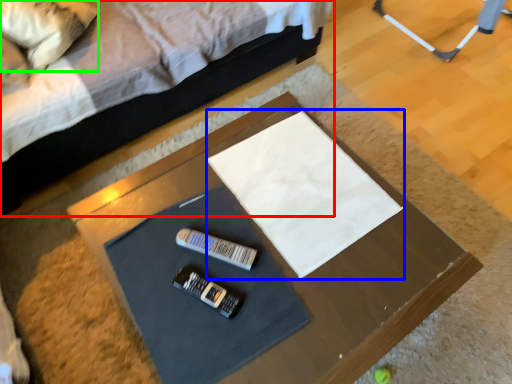
Question: Based on their relative distances, which object is nearer to bed (highlighted by a red box)? Choose from linen (highlighted by a blue box) and pillow (highlighted by a green box).

Choices:
 (A) linen
 (B) pillow

Answer: (B)